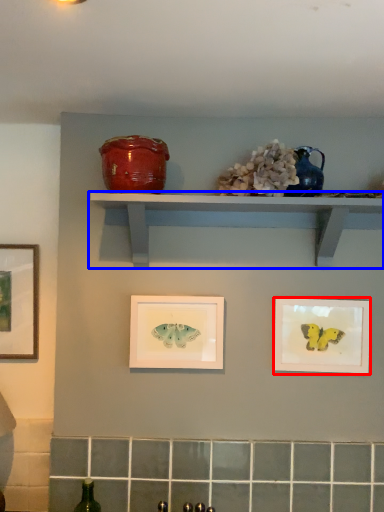
Question: Which point is further to the camera, picture frame (highlighted by a red box) or shelf (highlighted by a blue box)?

Choices:
 (A) picture frame
 (B) shelf

Answer: (A)